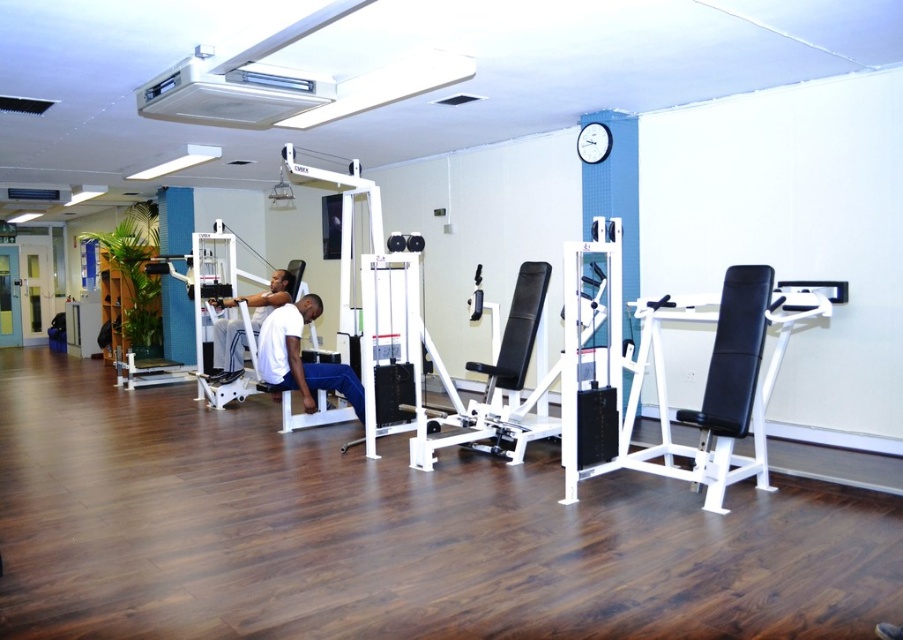
You are a gym member trying to locate the white matte bench at center and the white matte weight machine at center. Based on their positions, which one is to the left of the other?

The white matte bench at center is positioned on the right side of the white matte weight machine at center, so the white matte weight machine at center is to the left of the white matte bench at center.

You are setting up a workout routine in the gym and have both the white matte bench at center and the white matte weight machine at center available. Which equipment would you choose if you need something compact to save space?

The white matte bench at center is smaller than the white matte weight machine at center, so you should choose the white matte bench at center to save space.